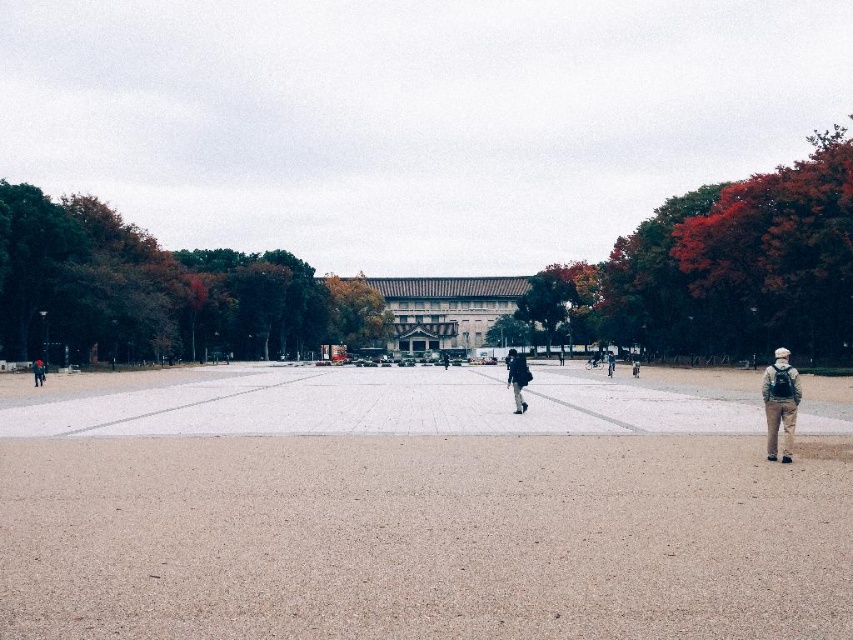
Does khaki pants at lower right have a greater height compared to khaki pants at center?

Indeed, khaki pants at lower right has a greater height compared to khaki pants at center.

Which of these two, khaki pants at lower right or khaki pants at center, stands taller?

khaki pants at lower right is taller.

What do you see at coordinates (780, 403) in the screenshot?
I see `khaki pants at lower right` at bounding box center [780, 403].

This screenshot has height=640, width=853. I want to click on khaki pants at lower right, so click(780, 403).

Is khaki pants at lower right below dark gray backpack at lower left?

Incorrect, khaki pants at lower right is not positioned below dark gray backpack at lower left.

Is khaki pants at lower right wider than dark gray backpack at lower left?

Correct, the width of khaki pants at lower right exceeds that of dark gray backpack at lower left.

Which is behind, point (769, 432) or point (42, 362)?

Positioned behind is point (42, 362).

Identify the location of khaki pants at lower right. tap(780, 403).

What are the coordinates of `khaki pants at lower right` in the screenshot? It's located at (780, 403).

Looking at this image, which is above, khaki pants at lower right or dark gray fabric jacket at center?

Positioned higher is khaki pants at lower right.

Is point (769, 392) positioned before point (514, 392)?

That is True.

Where is `khaki pants at lower right`? The width and height of the screenshot is (853, 640). khaki pants at lower right is located at coordinates (780, 403).